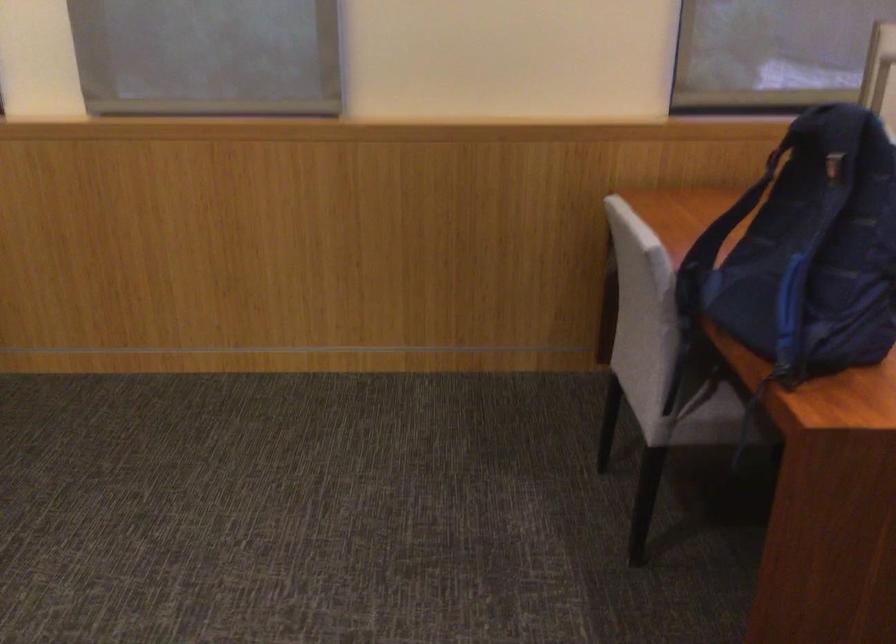
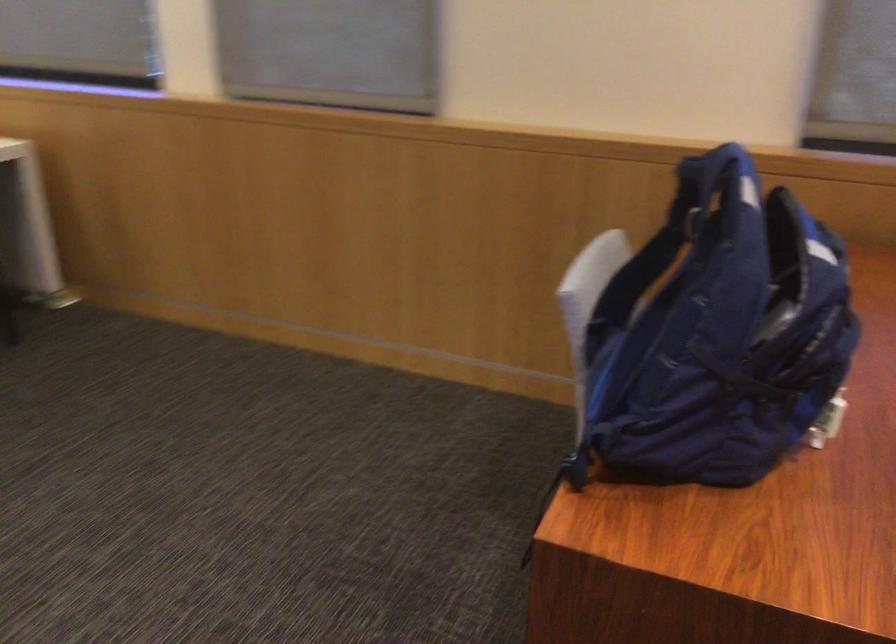
Question: The camera is either moving clockwise (left) or counter-clockwise (right) around the object. The first image is from the beginning of the video and the second image is from the end. Is the camera moving left or right when shooting the video?

Choices:
 (A) Left
 (B) Right

Answer: (B)